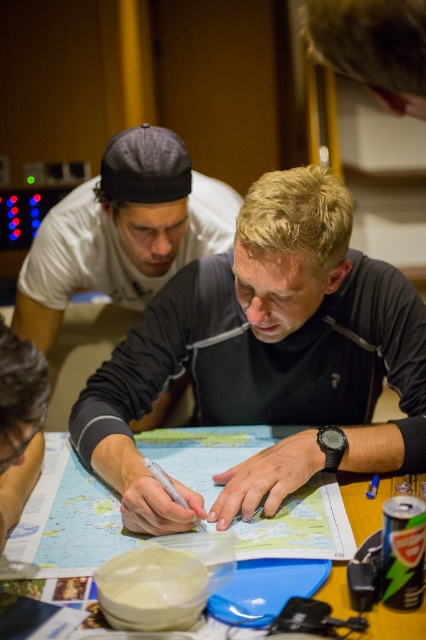
Question: Where is black matte shirt at center located in relation to wooden table at center in the image?

Choices:
 (A) above
 (B) below

Answer: (A)

Question: Is black matte shirt at upper center thinner than wooden table at center?

Choices:
 (A) yes
 (B) no

Answer: (B)

Question: Among these objects, which one is farthest from the camera?

Choices:
 (A) black matte shirt at center
 (B) wooden table at center
 (C) smooth wooden pen at lower left

Answer: (A)

Question: Where is black matte shirt at upper center located in relation to wooden table at center in the image?

Choices:
 (A) below
 (B) above

Answer: (B)

Question: Which point is closer to the camera?

Choices:
 (A) (62, 289)
 (B) (377, 509)

Answer: (B)

Question: Which point is farther to the camera?

Choices:
 (A) black matte shirt at center
 (B) smooth wooden pen at lower left
 (C) wooden table at center

Answer: (A)